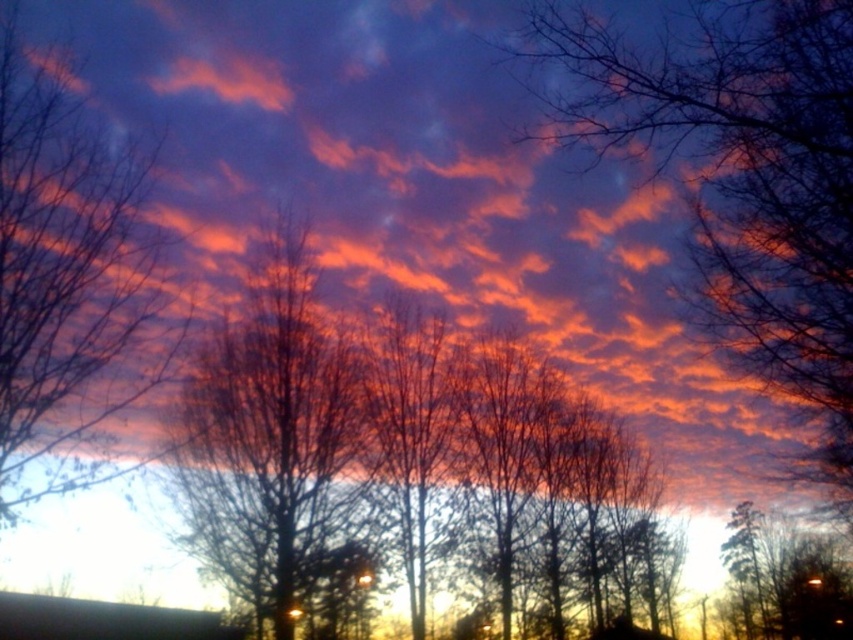
Question: Is silhouette bare branches at upper center to the left of bare branches at center from the viewer's perspective?

Choices:
 (A) no
 (B) yes

Answer: (A)

Question: Which of the following is the farthest from the observer?

Choices:
 (A) silhouette bare branches at upper center
 (B) bare branches at left
 (C) bare branches at center

Answer: (C)

Question: Considering the relative positions of silhouette bare branches at upper center and bare branches at center in the image provided, where is silhouette bare branches at upper center located with respect to bare branches at center?

Choices:
 (A) below
 (B) above

Answer: (B)

Question: Does silhouette bare branches at upper center come in front of bare branches at left?

Choices:
 (A) no
 (B) yes

Answer: (A)

Question: Which point is farther to the camera?

Choices:
 (A) (83, 113)
 (B) (714, 160)

Answer: (A)

Question: Which object is positioned closest to the silhouette bare branches at upper center?

Choices:
 (A) bare branches at center
 (B) bare branches at left

Answer: (B)